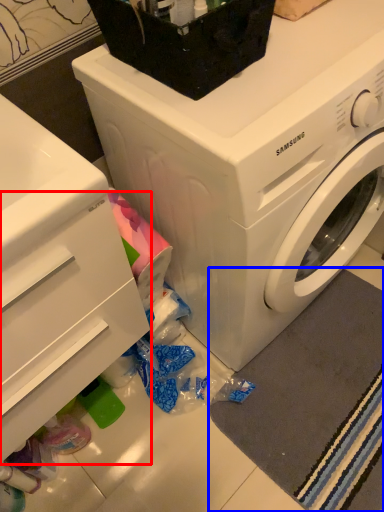
Question: Among these objects, which one is farthest to the camera, drawer (highlighted by a red box) or bath mat (highlighted by a blue box)?

Choices:
 (A) drawer
 (B) bath mat

Answer: (B)